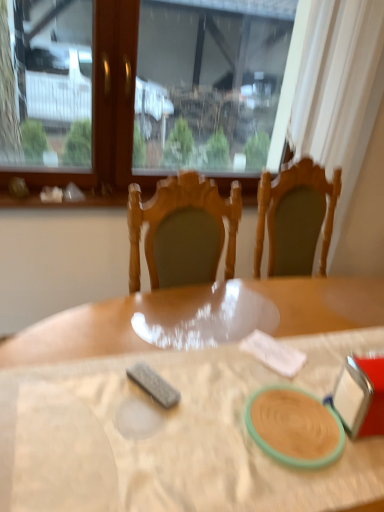
What are the coordinates of `vacant space to the left of matte green plate at center` in the screenshot? It's located at (200, 446).